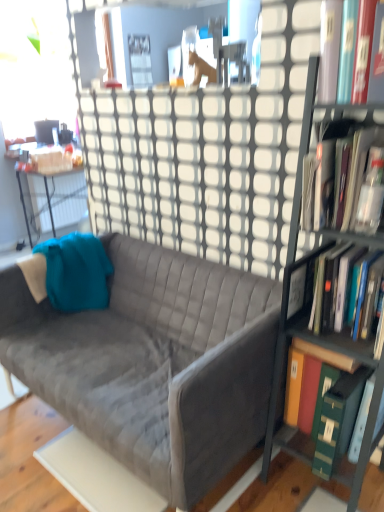
Question: Is hardcover book at upper right, which is the 4th book from bottom to top, completely or partially inside matte black desk at left?

Choices:
 (A) no
 (B) yes

Answer: (A)

Question: Considering the relative positions of matte black desk at left and hardcover book at upper right, which is the 4th book from bottom to top, in the image provided, is matte black desk at left behind hardcover book at upper right, which is the 4th book from bottom to top,?

Choices:
 (A) yes
 (B) no

Answer: (A)

Question: Considering the relative sizes of matte black desk at left and hardcover book at upper right, which is counted as the first book, starting from the top, in the image provided, is matte black desk at left shorter than hardcover book at upper right, which is counted as the first book, starting from the top,?

Choices:
 (A) no
 (B) yes

Answer: (A)

Question: Does matte black desk at left have a lesser width compared to hardcover book at upper right, which is the 4th book from bottom to top?

Choices:
 (A) yes
 (B) no

Answer: (A)

Question: Considering the relative positions of matte black desk at left and hardcover book at upper right, which is counted as the first book, starting from the top, in the image provided, is matte black desk at left to the left of hardcover book at upper right, which is counted as the first book, starting from the top, from the viewer's perspective?

Choices:
 (A) yes
 (B) no

Answer: (A)

Question: Is matte black desk at left spatially inside hardcover book at upper right, which is counted as the first book, starting from the top, or outside of it?

Choices:
 (A) inside
 (B) outside

Answer: (B)

Question: Considering the positions of matte black desk at left and hardcover book at upper right, which is counted as the first book, starting from the top, in the image, is matte black desk at left taller or shorter than hardcover book at upper right, which is counted as the first book, starting from the top,?

Choices:
 (A) short
 (B) tall

Answer: (B)

Question: From the image's perspective, relative to hardcover book at upper right, which is counted as the first book, starting from the top, is matte black desk at left above or below?

Choices:
 (A) below
 (B) above

Answer: (A)

Question: Considering the positions of point (3, 167) and point (372, 15), is point (3, 167) closer or farther from the camera than point (372, 15)?

Choices:
 (A) farther
 (B) closer

Answer: (A)

Question: From the image's perspective, is matte black desk at left above or below teal fabric throw pillow at left?

Choices:
 (A) above
 (B) below

Answer: (A)

Question: In the image, is matte black desk at left on the left side or the right side of teal fabric throw pillow at left?

Choices:
 (A) left
 (B) right

Answer: (A)

Question: Looking at their shapes, would you say matte black desk at left is wider or thinner than teal fabric throw pillow at left?

Choices:
 (A) wide
 (B) thin

Answer: (A)

Question: From a real-world perspective, relative to teal fabric throw pillow at left, is matte black desk at left vertically above or below?

Choices:
 (A) below
 (B) above

Answer: (A)

Question: Relative to matte black desk at left, is green hardcover book at right, which ranks as the first book in bottom-to-top order, in front or behind?

Choices:
 (A) behind
 (B) front

Answer: (B)

Question: Is green hardcover book at right, marked as the 4th book in a top-to-bottom arrangement, situated inside matte black desk at left or outside?

Choices:
 (A) inside
 (B) outside

Answer: (B)